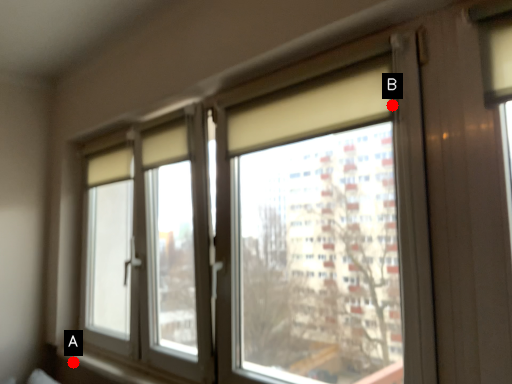
Question: Two points are circled on the image, labeled by A and B beside each circle. Among these points, which one is farthest from the camera?

Choices:
 (A) A is further
 (B) B is further

Answer: (A)